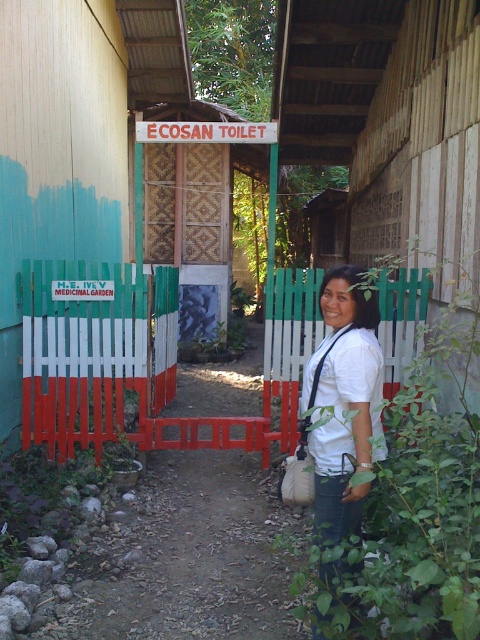
Question: Can you confirm if green painted wood fence at center is positioned below white matte shirt at center?

Choices:
 (A) no
 (B) yes

Answer: (A)

Question: Does green painted wood fence at center lie in front of green wooden fence at center?

Choices:
 (A) no
 (B) yes

Answer: (A)

Question: Which of the following is the farthest from the observer?

Choices:
 (A) green painted wood fence at center
 (B) white matte shirt at center
 (C) green wooden fence at center

Answer: (A)

Question: Which object is closer to the camera taking this photo?

Choices:
 (A) green wooden fence at center
 (B) white matte shirt at center
 (C) green painted wood fence at center

Answer: (B)

Question: Which point is closer to the camera?

Choices:
 (A) green wooden fence at center
 (B) green painted wood fence at center

Answer: (A)

Question: Does green painted wood fence at center have a greater width compared to green wooden fence at center?

Choices:
 (A) yes
 (B) no

Answer: (A)